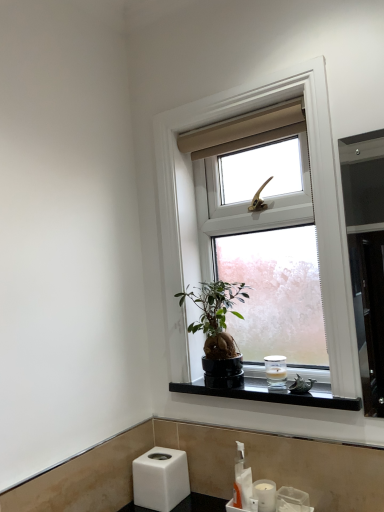
Question: Is black polished stone at lower center to the left or to the right of metallic silver bird at window in the image?

Choices:
 (A) right
 (B) left

Answer: (B)

Question: Looking at their shapes, would you say black polished stone at lower center is wider or thinner than metallic silver bird at window?

Choices:
 (A) thin
 (B) wide

Answer: (B)

Question: Which object is positioned farthest from the black polished stone at lower center?

Choices:
 (A) green matte houseplant at center
 (B) white plastic soap dispenser at lower center
 (C) matte white window at center
 (D) metallic silver bird at window
 (E) white glossy sink at lower center

Answer: (C)

Question: Considering the real-world distances, which object is farthest from the metallic silver bird at window?

Choices:
 (A) white matte candle at lower right, the second toiletry from the back
 (B) black polished stone at lower center
 (C) matte white window at center
 (D) green matte houseplant at center
 (E) white glossy sink at lower center

Answer: (C)